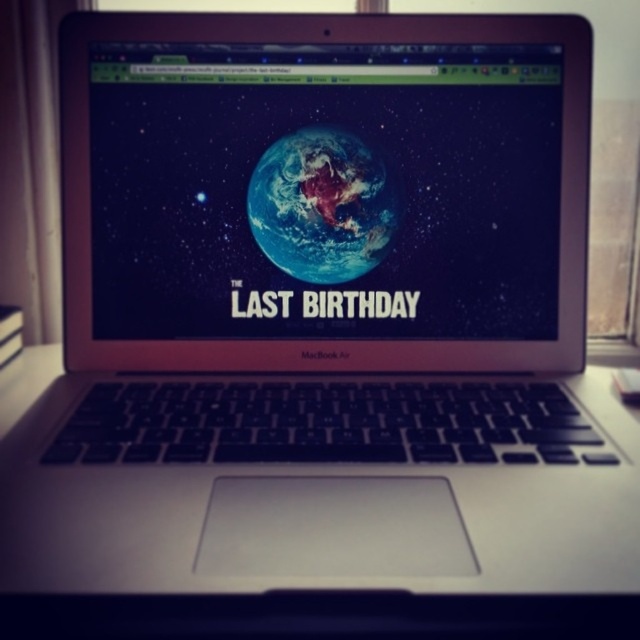
Is matte plastic screen at center further to camera compared to earth-like planet at center?

No, matte plastic screen at center is closer to the viewer.

Which of these two, matte plastic screen at center or earth-like planet at center, stands taller?

Standing taller between the two is matte plastic screen at center.

Describe the element at coordinates (324, 189) in the screenshot. The image size is (640, 640). I see `matte plastic screen at center` at that location.

I want to click on matte plastic screen at center, so pos(324,189).